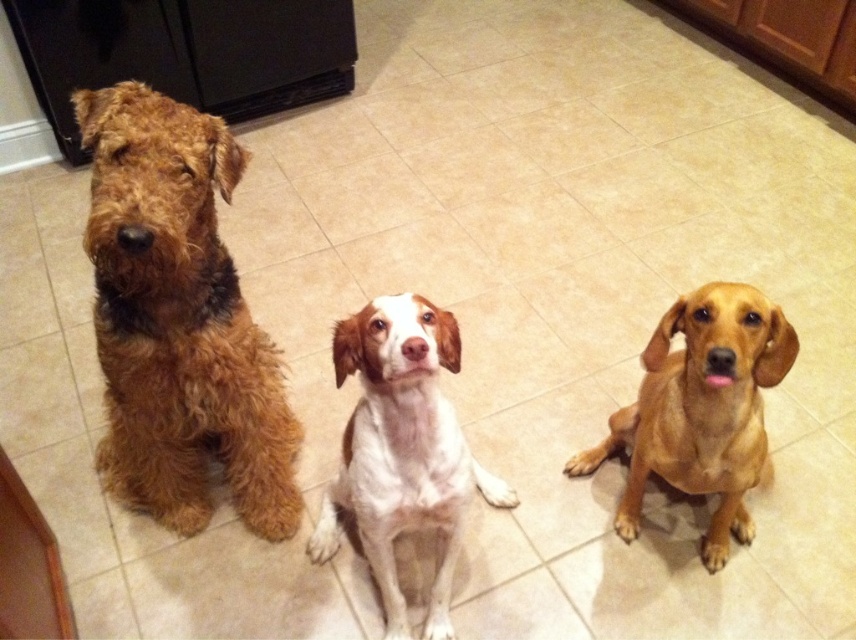
Based on the photo, you are a photographer setting up a shoot in a kitchen. You need to position two dogs for a photo. The dogs are the white soft fur dog at center and the golden smooth coat dog at center. According to the scene, which dog should you move to the right to create space between them?

The white soft fur dog at center is to the left of the golden smooth coat dog at center, so you should move the golden smooth coat dog at center to the right to create space between them.

You are standing in the kitchen and want to place a small plant pot at point [182,316]. The plant pot requires at least 3 feet of space from the camera to avoid blocking the view. Is the distance sufficient?

The distance of point [182,316] from the camera is 4.32 feet, which is greater than the required 3 feet, so the plant pot can be placed there without blocking the view.

You are a delivery robot that is 20 inches wide. You need to move through the kitchen where the white soft fur dog at center and the golden smooth coat dog at center are sitting. Can you pass between them without touching either dog?

The distance between the white soft fur dog at center and the golden smooth coat dog at center is 18.75 inches. Since the robot is 20 inches wide, it cannot fit through the 18.75 inch gap between them. You will need to find another path around the dogs.